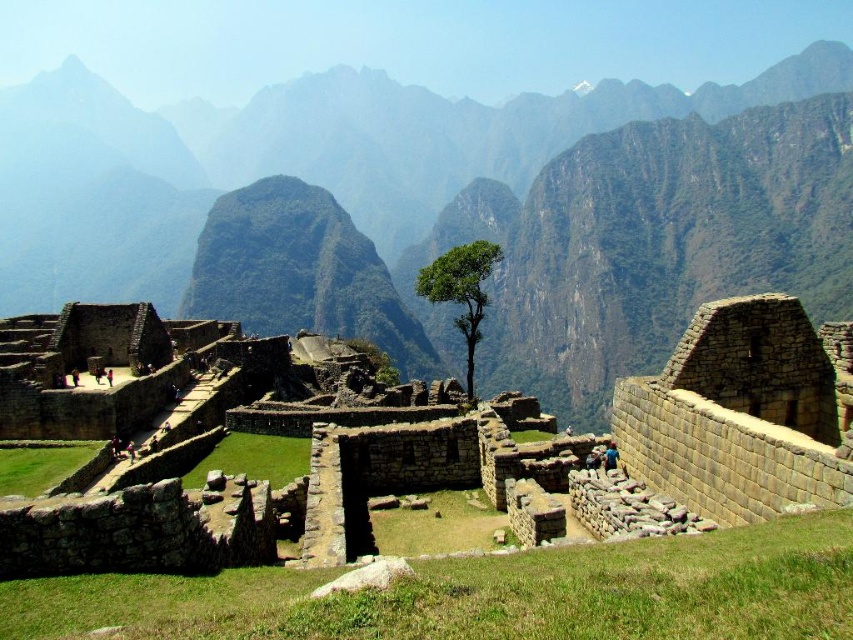
Question: Is rugged stone mountain at center bigger than green leafy tree at center?

Choices:
 (A) yes
 (B) no

Answer: (A)

Question: Which point is farther from the camera taking this photo?

Choices:
 (A) (224, 408)
 (B) (270, 248)

Answer: (B)

Question: Where is brown stone ruins at center located in relation to green leafy tree at center in the image?

Choices:
 (A) above
 (B) below

Answer: (B)

Question: Considering the relative positions of brown stone ruins at center and green leafy tree at center in the image provided, where is brown stone ruins at center located with respect to green leafy tree at center?

Choices:
 (A) below
 (B) above

Answer: (A)

Question: Which of the following is the farthest from the observer?

Choices:
 (A) brown stone ruins at center
 (B) green leafy tree at center

Answer: (B)

Question: Among these objects, which one is nearest to the camera?

Choices:
 (A) rugged stone mountain at center
 (B) green leafy tree at center

Answer: (B)